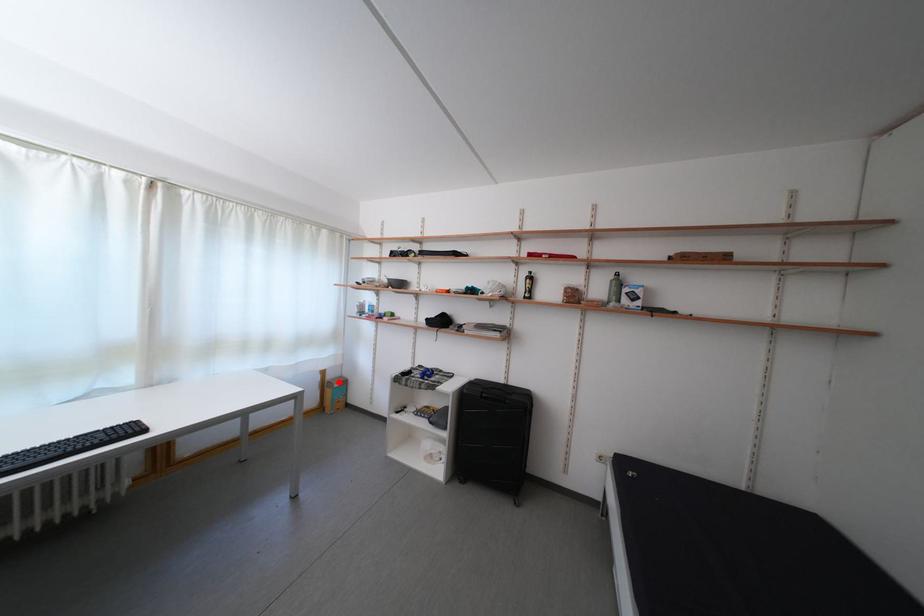
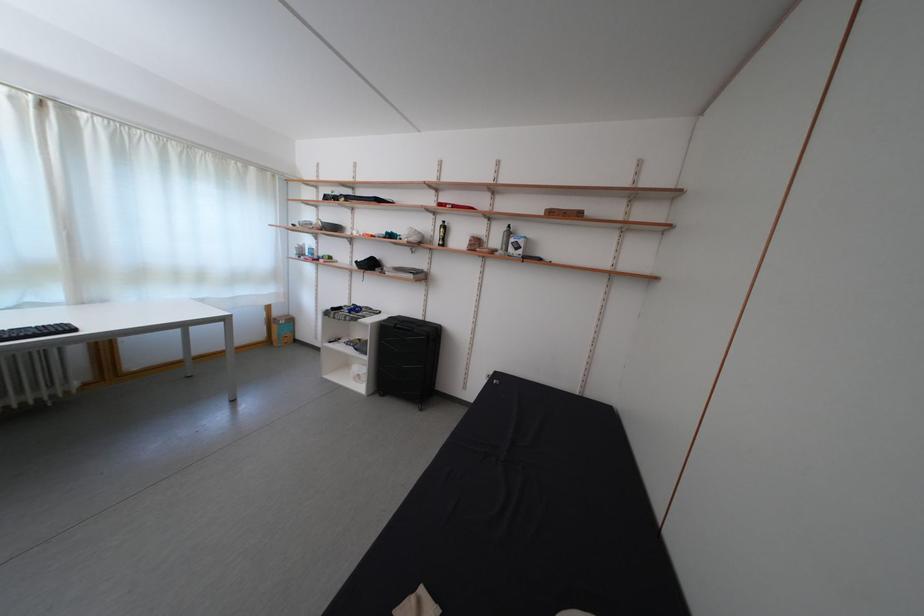
Locate, in the second image, the point that corresponds to the highlighted location in the first image.

(285, 320)